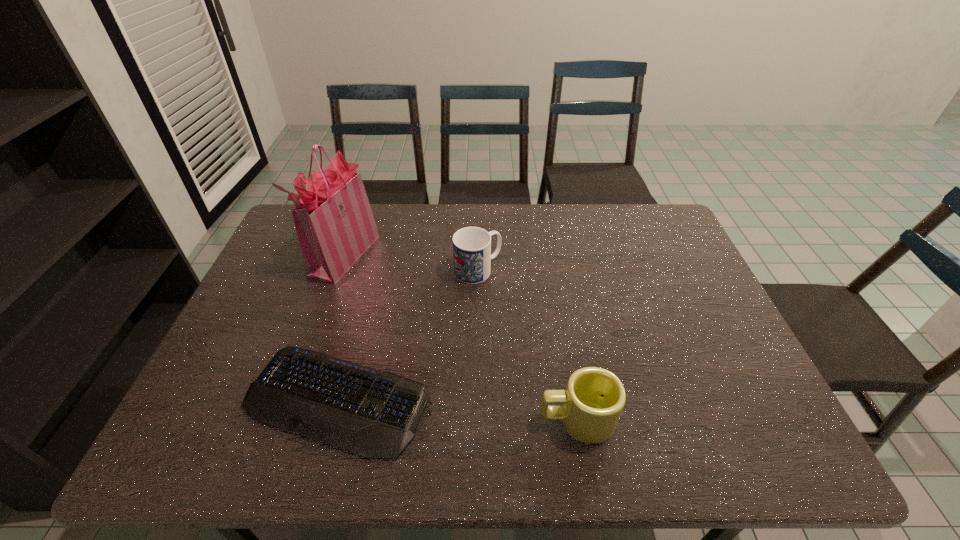
Where is `shopping bag`? shopping bag is located at coordinates (334, 222).

This screenshot has width=960, height=540. Identify the location of the farther mug. (472, 256).

You are a GUI agent. You are given a task and a screenshot of the screen. Output one action in this format:
    pyautogui.click(x=<x>, y=<y>)
    Task: Click on the left mug
    
    Given the screenshot: What is the action you would take?
    pyautogui.click(x=472, y=256)

Where is `the nearer mug`? The image size is (960, 540). the nearer mug is located at coordinates (594, 398).

Find the location of a particular element. the rightmost object is located at coordinates (594, 398).

The height and width of the screenshot is (540, 960). I want to click on computer keyboard, so click(371, 413).

Find the location of a particular element. This screenshot has height=540, width=960. blank space located on the right of the shopping bag is located at coordinates (394, 255).

Where is `free space located 0.140m on the front of the left mug`? free space located 0.140m on the front of the left mug is located at coordinates (478, 320).

Where is `vacant region located 0.400m with the handle on the side of the right mug`? This screenshot has width=960, height=540. vacant region located 0.400m with the handle on the side of the right mug is located at coordinates (359, 420).

The height and width of the screenshot is (540, 960). What are the coordinates of `blank space located with the handle on the side of the right mug` in the screenshot? It's located at (417, 420).